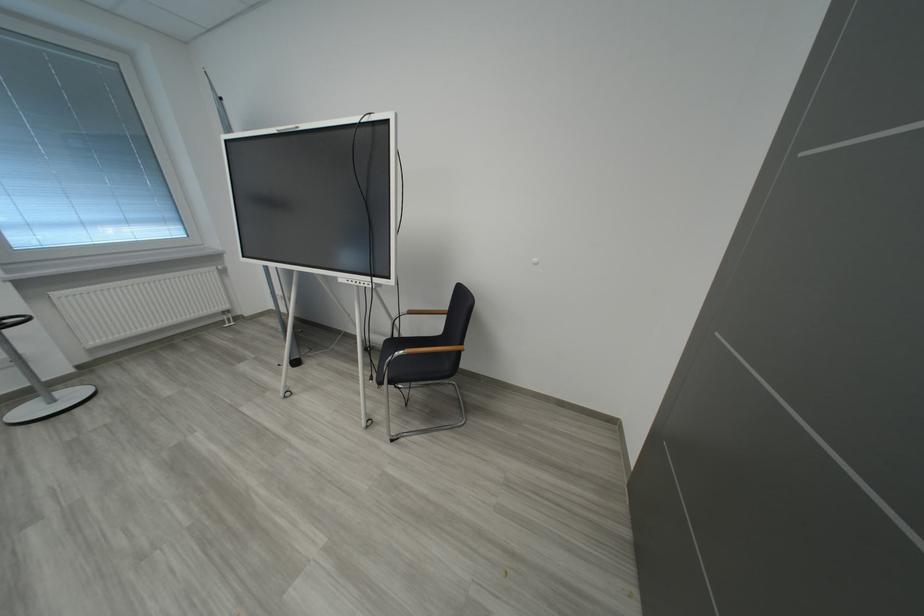
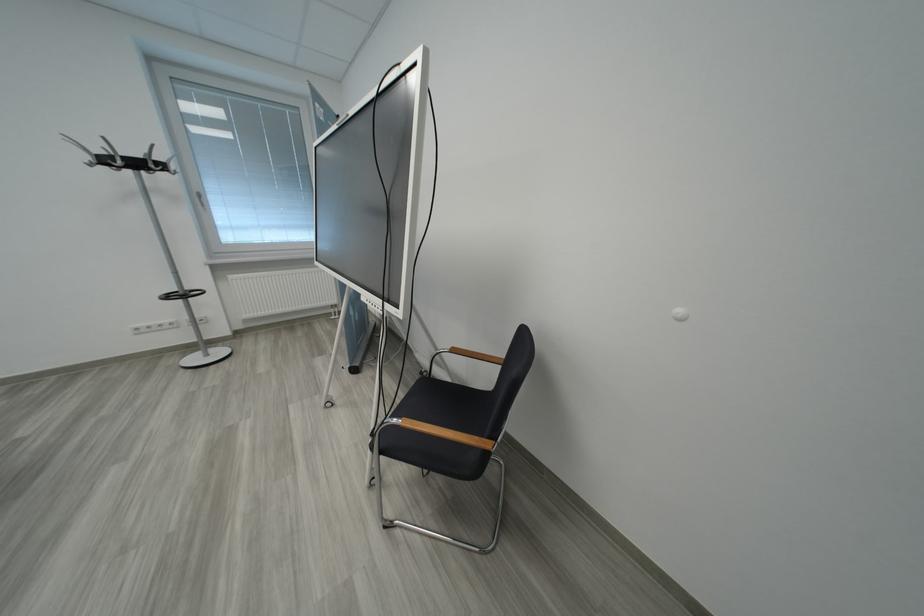
Question: What movement of the cameraman would produce the second image?

Choices:
 (A) Left
 (B) Right
 (C) Forward
 (D) Backward

Answer: (C)